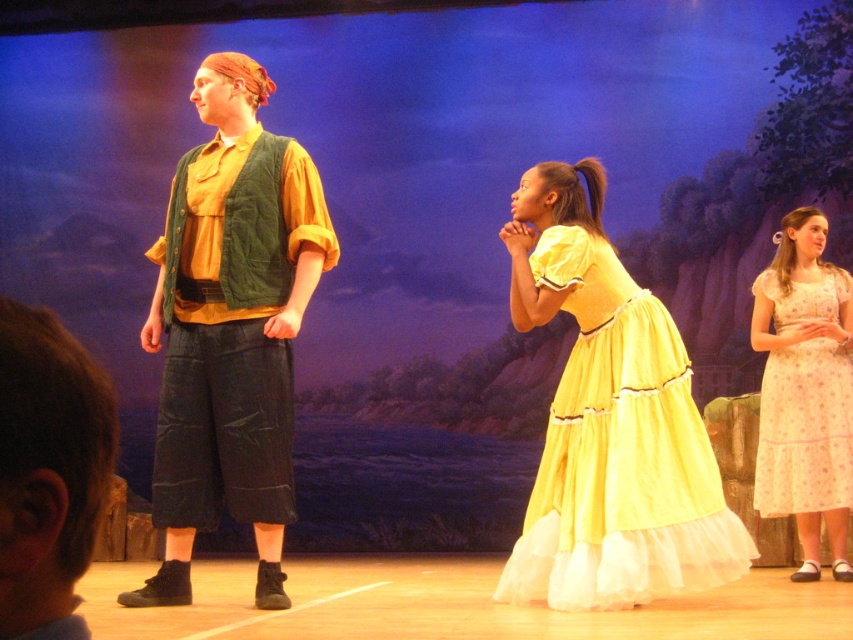
Looking at this image, who is more forward, [552,269] or [809,493]?

Point [552,269]

Is yellow cotton dress at center wider than light pink polka dot dress at right?

Yes.

Between point (561, 388) and point (836, 497), which one is positioned in front?

Point (561, 388) is more forward.

Where is `yellow cotton dress at center`? This screenshot has height=640, width=853. yellow cotton dress at center is located at coordinates (619, 452).

Which is above, matte green vest at left or yellow cotton dress at center?

Positioned higher is matte green vest at left.

Does matte green vest at left appear on the left side of yellow cotton dress at center?

Correct, you'll find matte green vest at left to the left of yellow cotton dress at center.

Does point (177, 504) come closer to viewer compared to point (688, 435)?

No, (177, 504) is behind (688, 435).

Where is `matte green vest at left`? The height and width of the screenshot is (640, 853). matte green vest at left is located at coordinates (230, 328).

Does matte green vest at left have a lesser height compared to light pink polka dot dress at right?

No.

Does point (282, 468) come behind point (782, 401)?

No, it is in front of (782, 401).

Between point (223, 157) and point (849, 385), which one is positioned behind?

Point (849, 385)

You are a GUI agent. You are given a task and a screenshot of the screen. Output one action in this format:
    pyautogui.click(x=<x>, y=<y>)
    Task: Click on the matte green vest at left
    This screenshot has width=853, height=640.
    Given the screenshot: What is the action you would take?
    pyautogui.click(x=230, y=328)